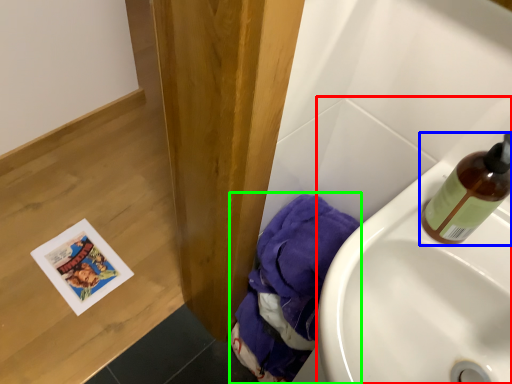
Question: Based on their relative distances, which object is farther from sink (highlighted by a red box)? Choose from bottle (highlighted by a blue box) and material (highlighted by a green box).

Choices:
 (A) bottle
 (B) material

Answer: (B)